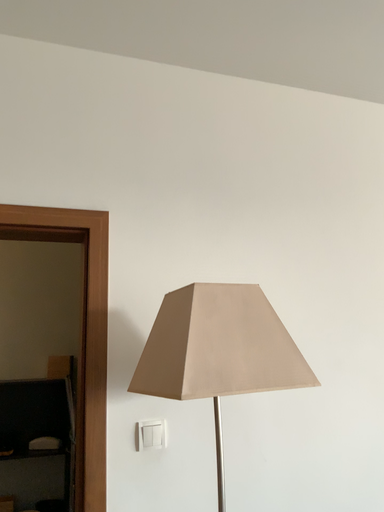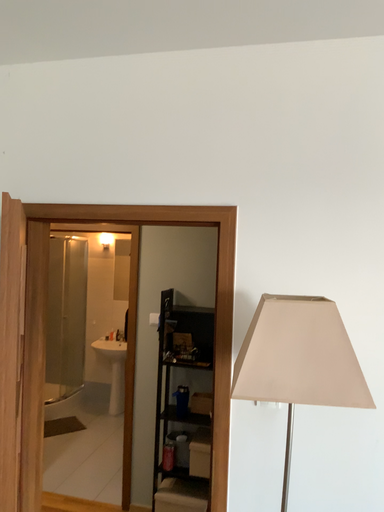
Question: Which way did the camera rotate in the video?

Choices:
 (A) rotated left
 (B) rotated right

Answer: (A)